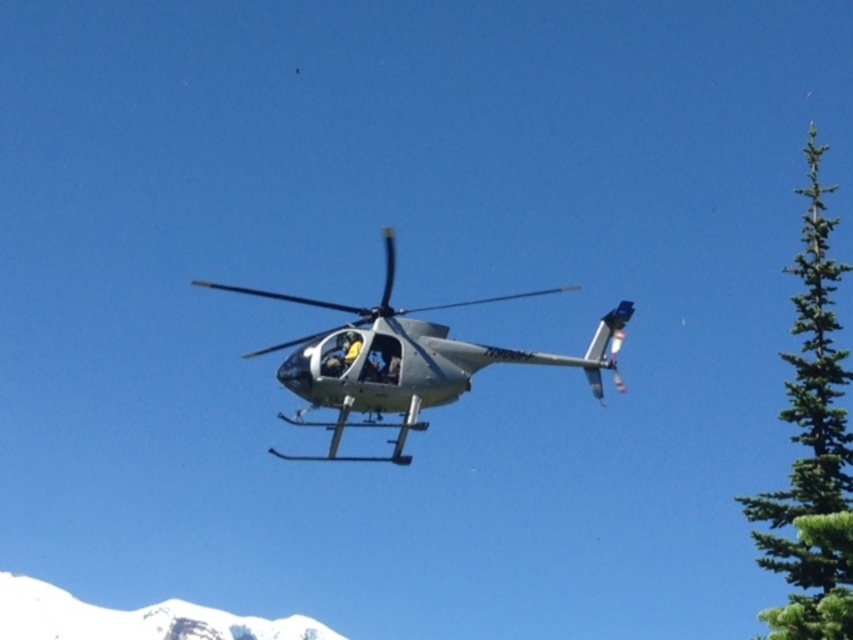
You are a pilot flying a metallic silver helicopter at center. You need to land at a specific point marked at coordinate point (410, 362). Are you already at the correct landing point?

The metallic silver helicopter at center is located at point (410, 362), so yes, the helicopter is already at the correct landing point.